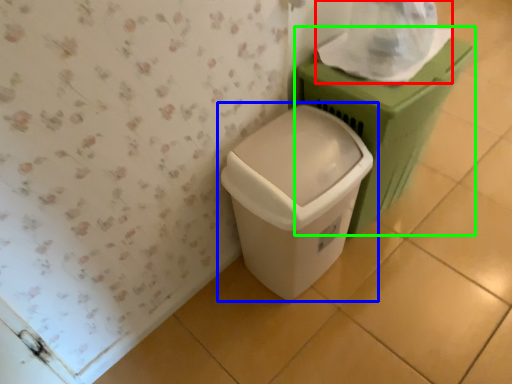
Question: Which is farther away from toilet paper (highlighted by a red box)? waste container (highlighted by a blue box) or waste container (highlighted by a green box)?

Choices:
 (A) waste container
 (B) waste container

Answer: (A)